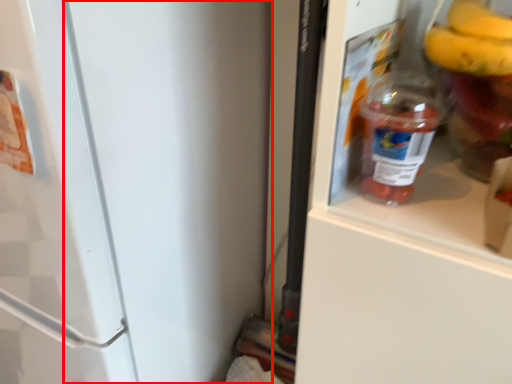
Question: Observing the image, what is the correct spatial positioning of door (annotated by the red box) in reference to bottle?

Choices:
 (A) right
 (B) left

Answer: (B)